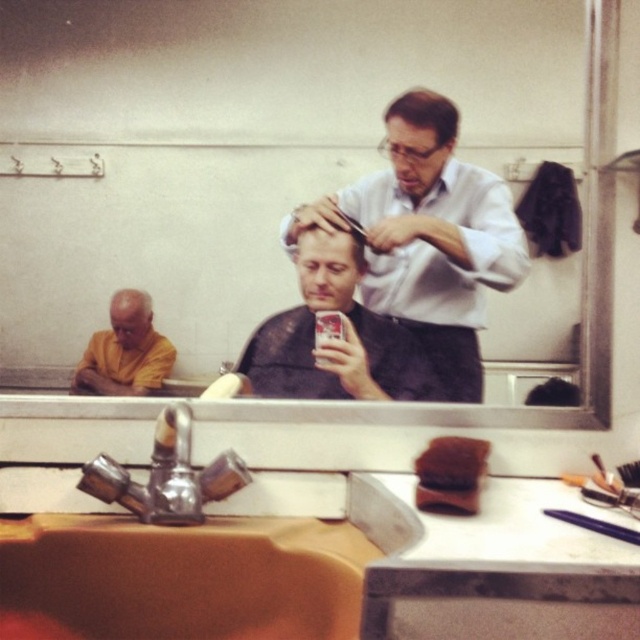
Who is shorter, reflective glass mirror at center or yellow cloth at left?

Standing shorter between the two is yellow cloth at left.

Can you confirm if reflective glass mirror at center is positioned to the left of yellow cloth at left?

Incorrect, reflective glass mirror at center is not on the left side of yellow cloth at left.

Does point (1, 397) come farther from viewer compared to point (113, 323)?

No, (1, 397) is closer to viewer.

At what (x,y) coordinates should I click in order to perform the action: click on reflective glass mirror at center. Please return your answer as a coordinate pair (x, y). Looking at the image, I should click on (280, 164).

Does yellow cloth at left appear over smooth brown hair at center?

Incorrect, yellow cloth at left is not positioned above smooth brown hair at center.

Does yellow cloth at left have a greater height compared to smooth brown hair at center?

Yes.

At what (x,y) coordinates should I click in order to perform the action: click on yellow cloth at left. Please return your answer as a coordinate pair (x, y). Image resolution: width=640 pixels, height=640 pixels. Looking at the image, I should click on (125, 349).

This screenshot has height=640, width=640. I want to click on yellow cloth at left, so click(x=125, y=349).

Can you confirm if brown ceramic sink at lower center is positioned above smooth black hair at center?

Actually, brown ceramic sink at lower center is below smooth black hair at center.

In the scene shown: Is brown ceramic sink at lower center below smooth black hair at center?

Correct, brown ceramic sink at lower center is located below smooth black hair at center.

Between point (180, 557) and point (396, 385), which one is positioned in front?

Point (180, 557) is more forward.

Where is `brown ceramic sink at lower center`? The width and height of the screenshot is (640, 640). brown ceramic sink at lower center is located at coordinates (266, 563).